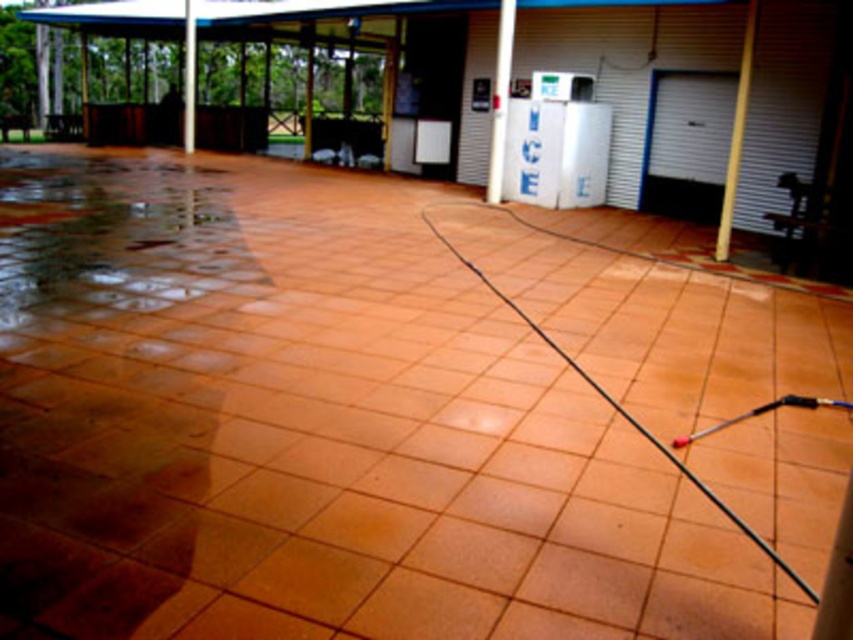
Question: Among these points, which one is farthest from the camera?

Choices:
 (A) (418, 58)
 (B) (193, 81)
 (C) (732, 125)
 (D) (502, 12)

Answer: (B)

Question: Is smooth concrete garage at center positioned at the back of wooden pole at right?

Choices:
 (A) no
 (B) yes

Answer: (B)

Question: Can you confirm if smooth concrete garage at center is thinner than white smooth pillar at upper left?

Choices:
 (A) no
 (B) yes

Answer: (A)

Question: Does white glossy pole at upper center appear over white smooth pillar at upper left?

Choices:
 (A) yes
 (B) no

Answer: (B)

Question: Which of the following is the farthest from the observer?

Choices:
 (A) smooth concrete garage at center
 (B) white smooth pillar at upper left
 (C) white glossy pole at upper center
 (D) wooden pole at right

Answer: (B)

Question: Among these points, which one is nearest to the camera?

Choices:
 (A) (184, 76)
 (B) (172, 0)

Answer: (B)